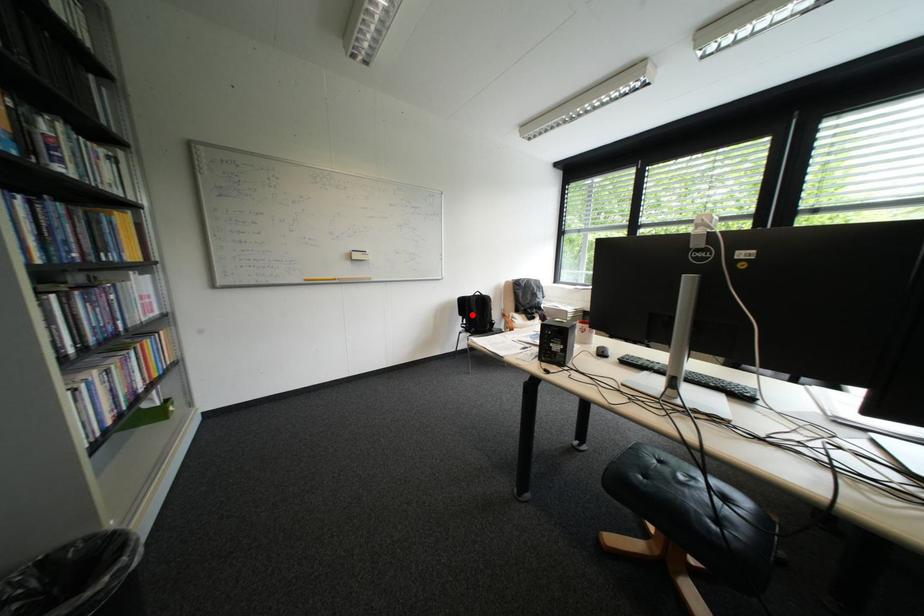
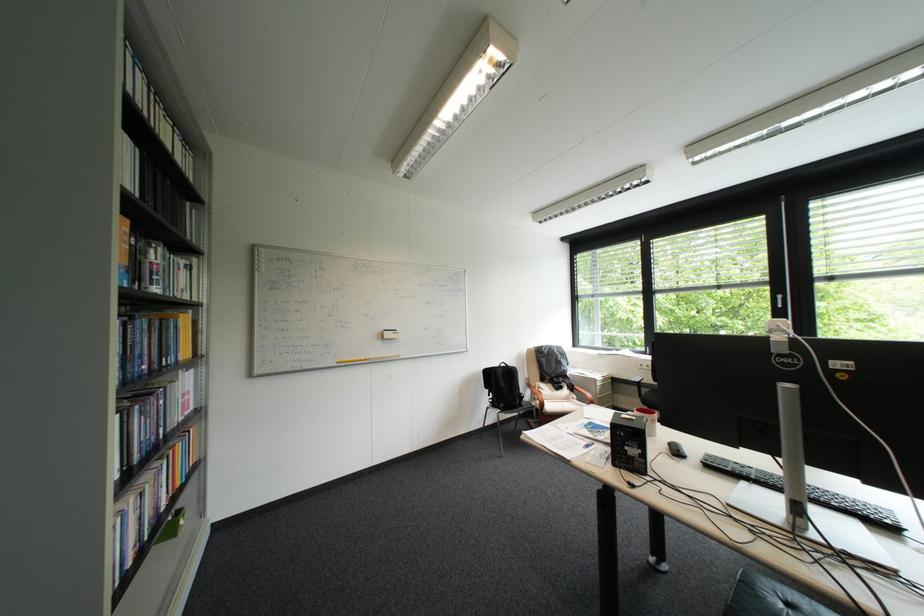
The point at the highlighted location is marked in the first image. Where is the corresponding point in the second image?

(497, 387)